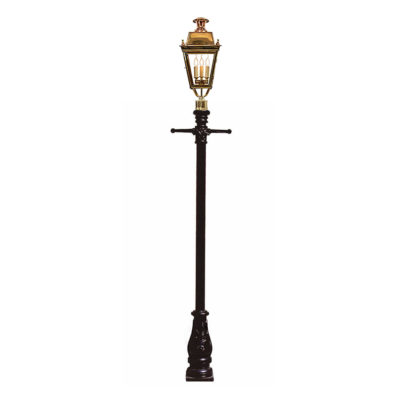
You are a GUI agent. You are given a task and a screenshot of the screen. Output one action in this format:
    pyautogui.click(x=<x>, y=<y>)
    Task: Click on the lantern
    Image resolution: width=400 pixels, height=400 pixels.
    Given the screenshot: What is the action you would take?
    (x=201, y=47)